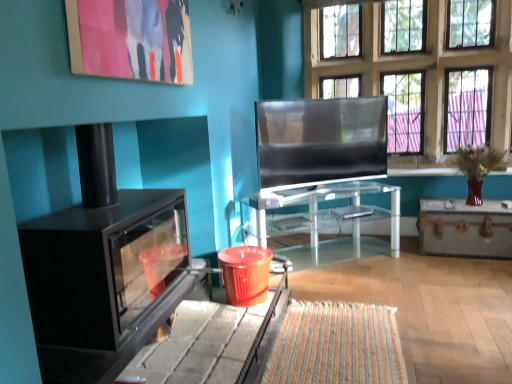
Question: Is metallic trunk at right, acting as the 1th table starting from the right, a part of matte black tv at center?

Choices:
 (A) no
 (B) yes

Answer: (A)

Question: Is matte black tv at center positioned far away from metallic trunk at right, acting as the 1th table starting from the right?

Choices:
 (A) no
 (B) yes

Answer: (A)

Question: From the image's perspective, would you say matte black tv at center is shown under metallic trunk at right, the second table when ordered from left to right?

Choices:
 (A) yes
 (B) no

Answer: (B)

Question: Is matte black tv at center positioned in front of metallic trunk at right, the second table when ordered from left to right?

Choices:
 (A) no
 (B) yes

Answer: (B)

Question: Does matte black tv at center have a lesser height compared to metallic trunk at right, the second table when ordered from left to right?

Choices:
 (A) no
 (B) yes

Answer: (A)

Question: From the image's perspective, is transparent glass table at center, the second table positioned from the right, located above or below matte black tv at center?

Choices:
 (A) above
 (B) below

Answer: (B)

Question: Looking at the image, does transparent glass table at center, the second table positioned from the right, seem bigger or smaller compared to matte black tv at center?

Choices:
 (A) big
 (B) small

Answer: (A)

Question: Considering the positions of transparent glass table at center, the second table positioned from the right, and matte black tv at center in the image, is transparent glass table at center, the second table positioned from the right, wider or thinner than matte black tv at center?

Choices:
 (A) wide
 (B) thin

Answer: (A)

Question: Is transparent glass table at center, the 1th table viewed from the left, inside or outside of matte black tv at center?

Choices:
 (A) outside
 (B) inside

Answer: (A)

Question: Based on their sizes in the image, would you say matte black tv at center is bigger or smaller than metallic trunk at right, the second table when ordered from left to right?

Choices:
 (A) big
 (B) small

Answer: (B)

Question: Is matte black tv at center to the left or to the right of metallic trunk at right, the second table when ordered from left to right, in the image?

Choices:
 (A) left
 (B) right

Answer: (A)

Question: Considering the positions of point (340, 140) and point (467, 238), is point (340, 140) closer or farther from the camera than point (467, 238)?

Choices:
 (A) farther
 (B) closer

Answer: (A)

Question: From a real-world perspective, relative to metallic trunk at right, the second table when ordered from left to right, is matte black tv at center vertically above or below?

Choices:
 (A) below
 (B) above

Answer: (B)

Question: From a real-world perspective, is glass paneled window at upper center physically located above or below transparent glass table at center, the 1th table viewed from the left?

Choices:
 (A) above
 (B) below

Answer: (A)

Question: Based on their sizes in the image, would you say glass paneled window at upper center is bigger or smaller than transparent glass table at center, the second table positioned from the right?

Choices:
 (A) big
 (B) small

Answer: (A)